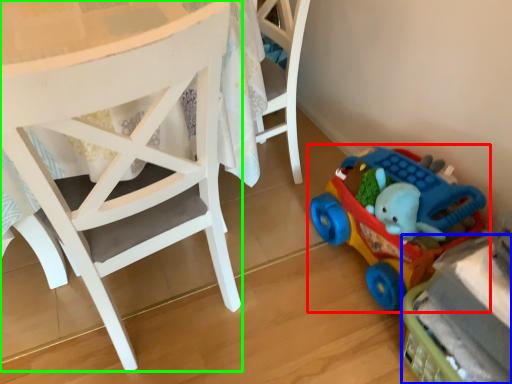
Question: Which object is the closest to the toy (highlighted by a red box)? Choose among these: toy (highlighted by a blue box) or chair (highlighted by a green box).

Choices:
 (A) toy
 (B) chair

Answer: (A)